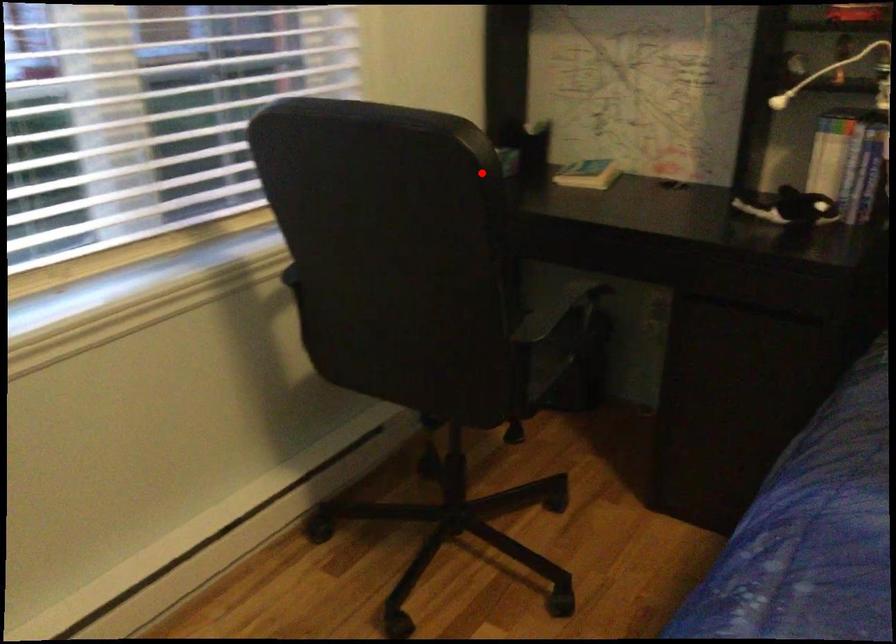
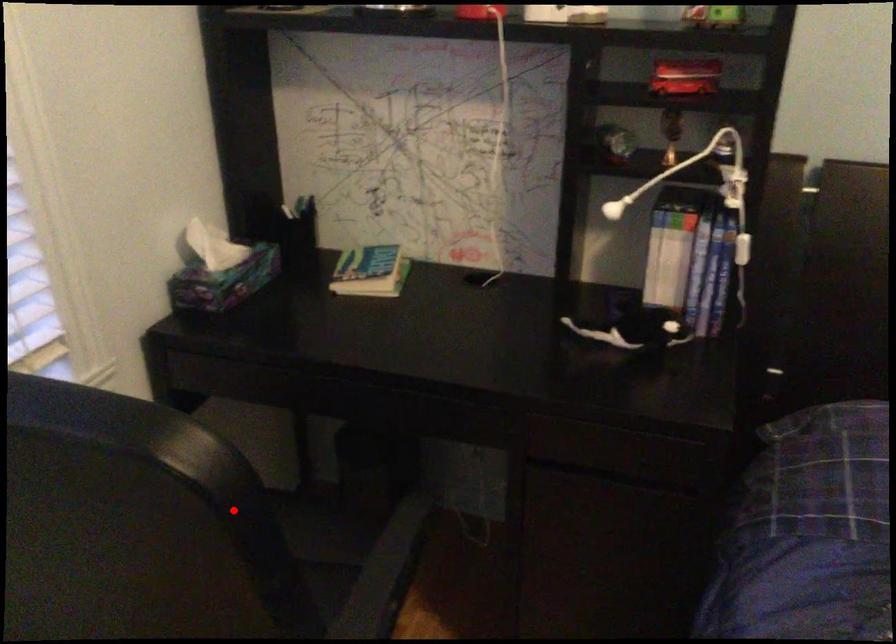
I am providing you with two images of the same scene from different viewpoints. A red point is marked on the first image and another point is marked on the second image. Do the highlighted points in image1 and image2 indicate the same real-world spot?

Yes